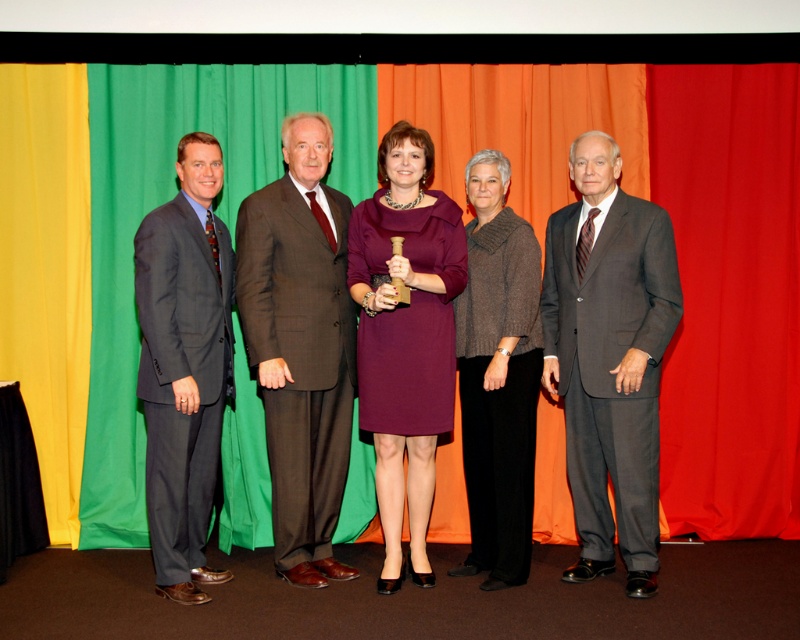
You are taking a photo of the group and need to focus on the dark gray suit at center. What are the coordinates where you should aim your camera?

The coordinates to focus on are at point (609, 356).

You are a photographer reviewing the group photo. You notice two central figures wearing the dark gray suit at center and the purple satin dress at center. Which one is standing to the left of the other?

The dark gray suit at center is positioned on the right side of purple satin dress at center, so the purple satin dress at center is to the left of the dark gray suit at center.